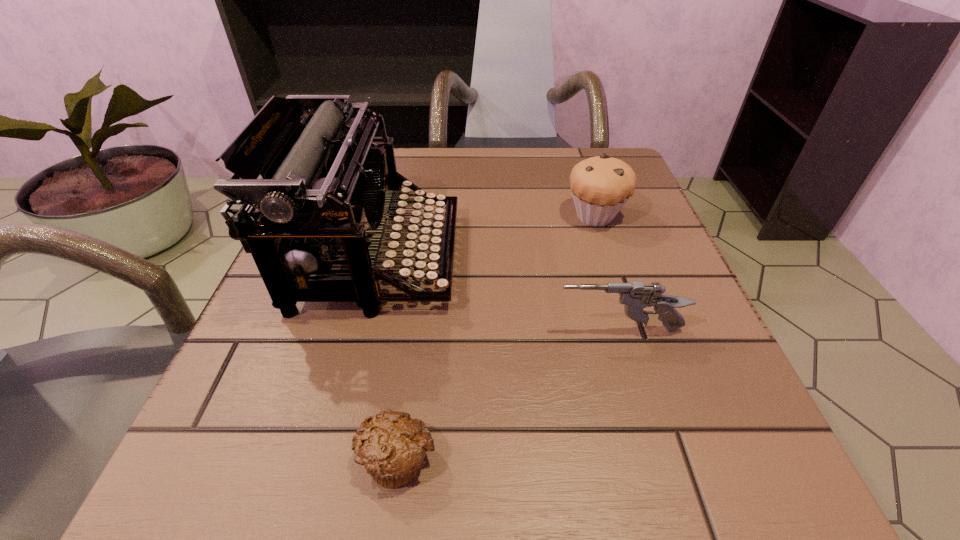
In order to click on empty space that is in between the nearer muffin and the typewriter in this screenshot , I will do `click(387, 357)`.

At what (x,y) coordinates should I click in order to perform the action: click on vacant area between the typewriter and the shorter muffin. Please return your answer as a coordinate pair (x, y). Looking at the image, I should click on (387, 357).

Locate an element on the screen. free spot between the typewriter and the nearer muffin is located at coordinates (387, 357).

What are the coordinates of `the second closest object to the right muffin` in the screenshot? It's located at (636, 296).

The width and height of the screenshot is (960, 540). What are the coordinates of `object that is the third closest to the second tallest object` in the screenshot? It's located at (391, 447).

Where is `blank area in the image that satisfies the following two spatial constraints: 1. on the typing side of the typewriter; 2. on the left side of the nearer muffin`? The height and width of the screenshot is (540, 960). blank area in the image that satisfies the following two spatial constraints: 1. on the typing side of the typewriter; 2. on the left side of the nearer muffin is located at coordinates (324, 457).

At what (x,y) coordinates should I click in order to perform the action: click on blank area in the image that satisfies the following two spatial constraints: 1. at the barrel of the gun; 2. on the front side of the nearest object. Please return your answer as a coordinate pair (x, y). The width and height of the screenshot is (960, 540). Looking at the image, I should click on (658, 457).

You are a GUI agent. You are given a task and a screenshot of the screen. Output one action in this format:
    pyautogui.click(x=<x>, y=<y>)
    Task: Click on the free location that satisfies the following two spatial constraints: 1. on the front side of the second tallest object; 2. on the typing side of the typewriter
    
    Given the screenshot: What is the action you would take?
    pyautogui.click(x=609, y=258)

Identify the location of free point that satisfies the following two spatial constraints: 1. on the typing side of the nearest object; 2. on the left side of the tallest object. This screenshot has width=960, height=540. (324, 457).